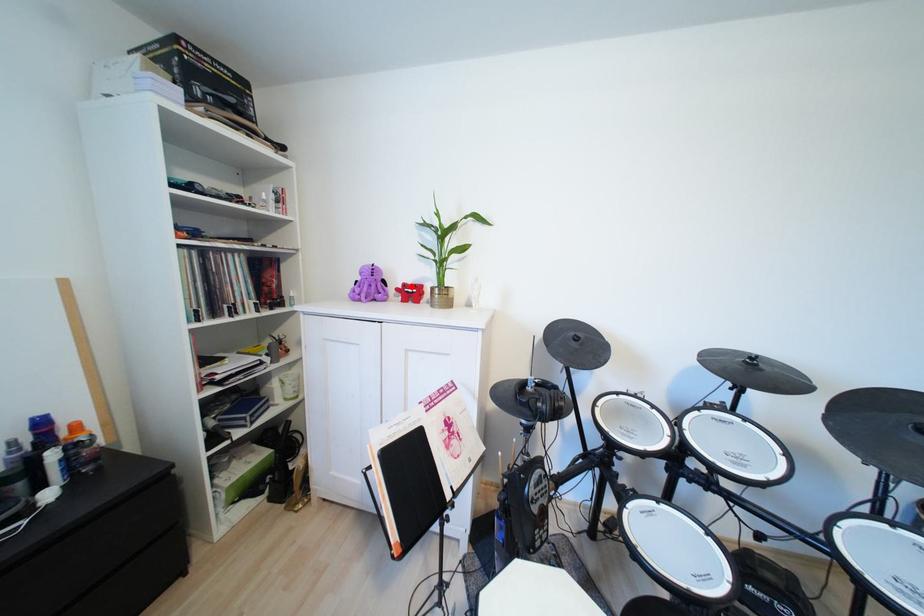
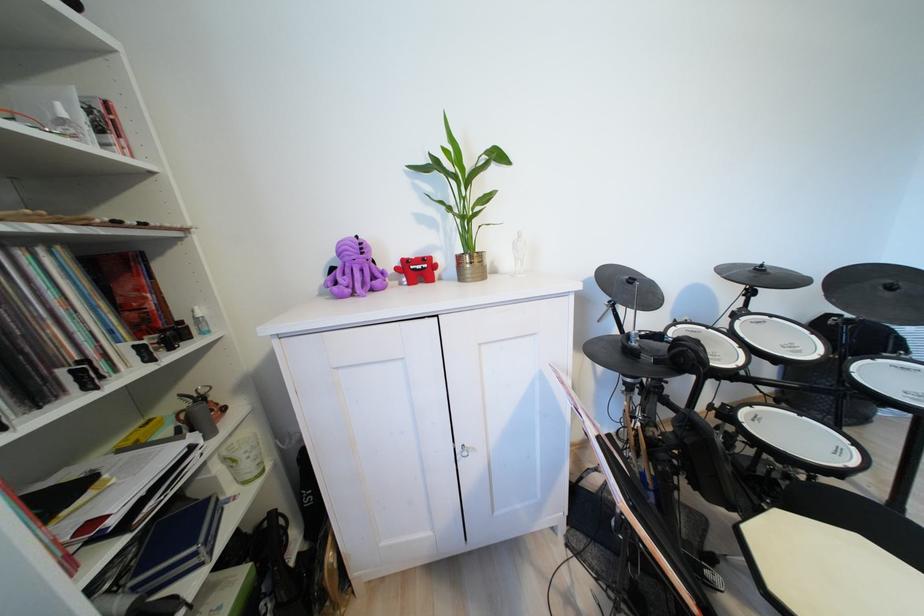
The point at the highlighted location is marked in the first image. Where is the corresponding point in the second image?

(411, 262)